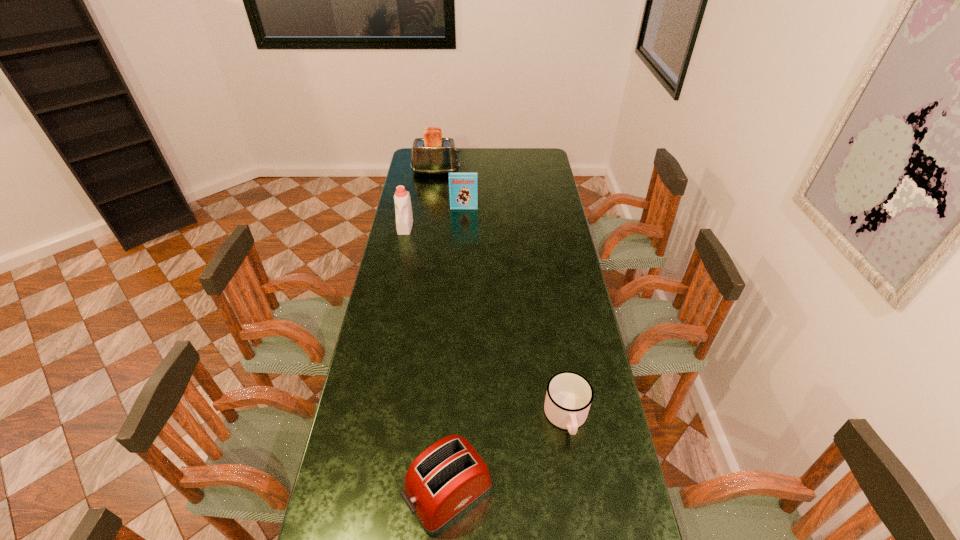
At what (x,y) coordinates should I click in order to perform the action: click on blank space at the right edge of the desktop. Please return your answer as a coordinate pair (x, y). This screenshot has height=540, width=960. Looking at the image, I should click on (596, 467).

The width and height of the screenshot is (960, 540). In the image, there is a desktop. Identify the location of free space at the far right corner. (543, 164).

Identify the location of free area in between the rightmost object and the nearest object. (508, 454).

I want to click on vacant region between the nearer toaster and the rightmost object, so click(x=508, y=454).

Identify the location of vacant region between the nearest object and the tallest object. This screenshot has height=540, width=960. (443, 332).

This screenshot has width=960, height=540. Identify the location of unoccupied position between the shorter toaster and the farther toaster. (443, 332).

The width and height of the screenshot is (960, 540). What are the coordinates of `vacant area that lies between the farthest object and the third farthest object` in the screenshot? It's located at (420, 199).

Locate an element on the screen. The height and width of the screenshot is (540, 960). vacant area that lies between the rightmost object and the third farthest object is located at coordinates (486, 322).

Find the location of `free spot between the mug and the farthest object`. free spot between the mug and the farthest object is located at coordinates (501, 294).

In order to click on vacant point located between the fourth nearest object and the detergent in this screenshot , I will do `click(435, 218)`.